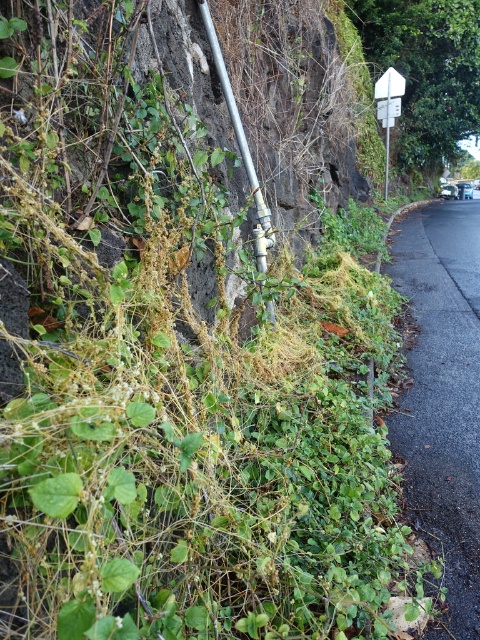
Between metallic pipe at center and white plastic sign at upper right, which one is positioned lower?

metallic pipe at center

Which is behind, point (263, 208) or point (396, 72)?

Point (396, 72)

Find the location of `metallic pipe at center`. metallic pipe at center is located at coordinates pos(240,147).